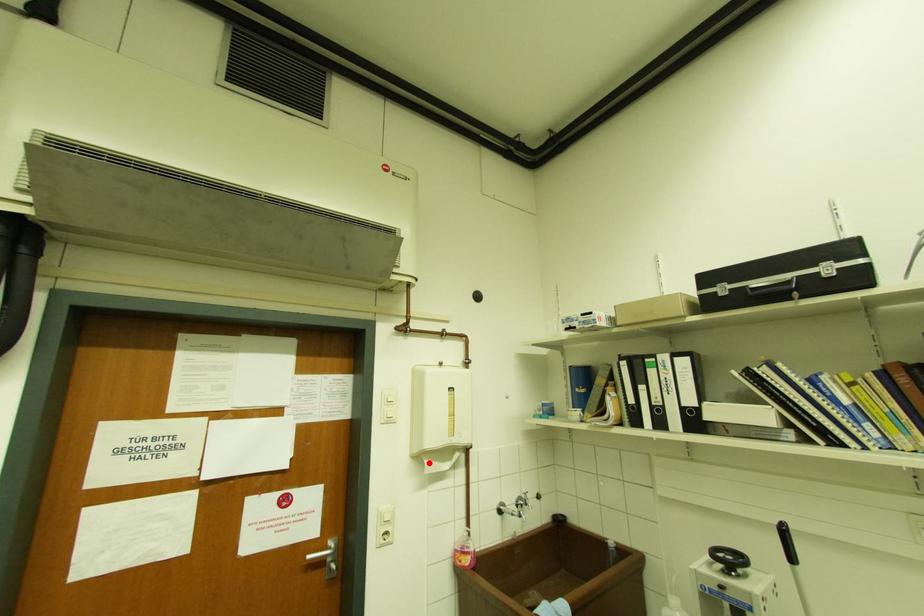
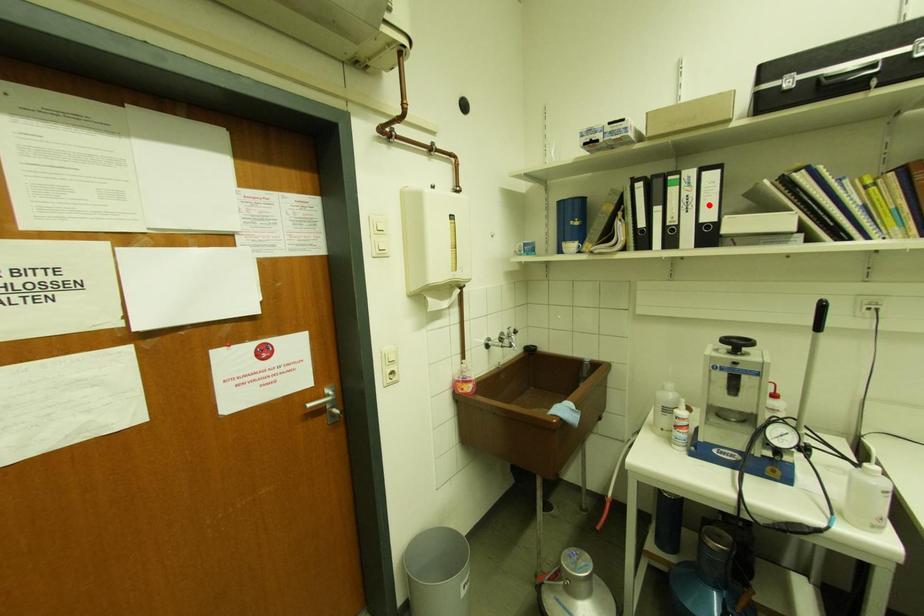
I am providing you with two images of the same scene from different viewpoints. A red point is marked on the first image and another point is marked on the second image. Is the marked point in image1 the same physical position as the marked point in image2?

No